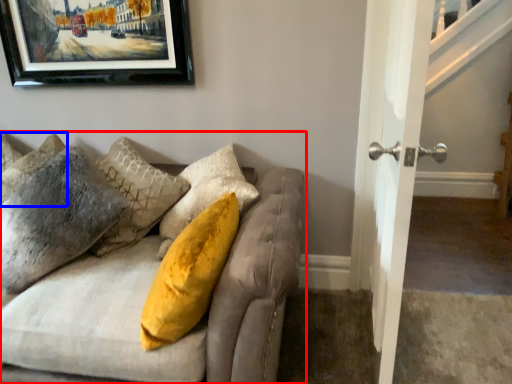
Question: Which point is closer to the camera, studio couch (highlighted by a red box) or pillow (highlighted by a blue box)?

Choices:
 (A) studio couch
 (B) pillow

Answer: (A)